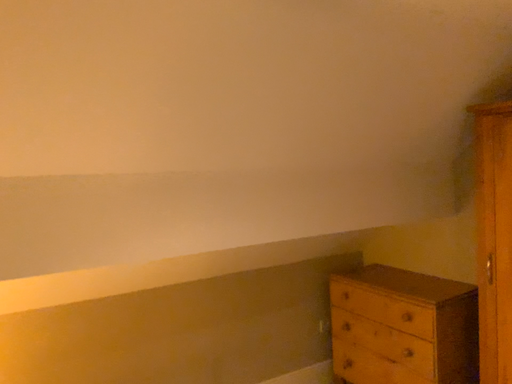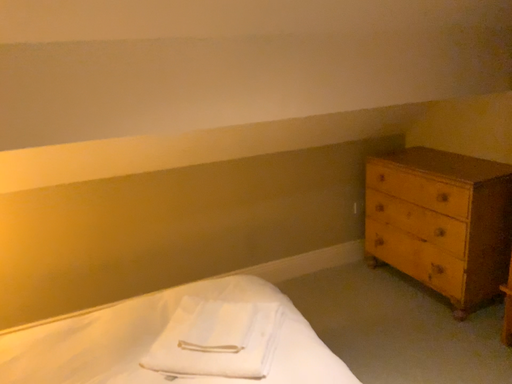
Question: Which way did the camera rotate in the video?

Choices:
 (A) rotated downward
 (B) rotated upward

Answer: (A)